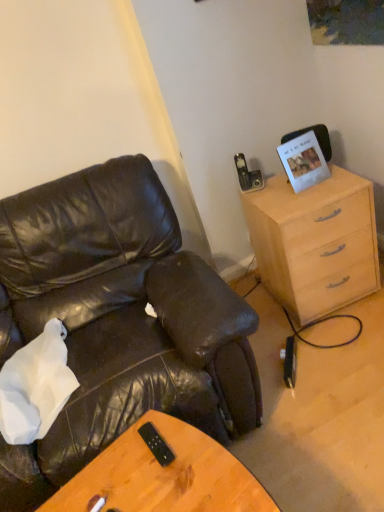
Locate an element on the screen. unoccupied area in front of black plastic remote at center is located at coordinates tap(172, 487).